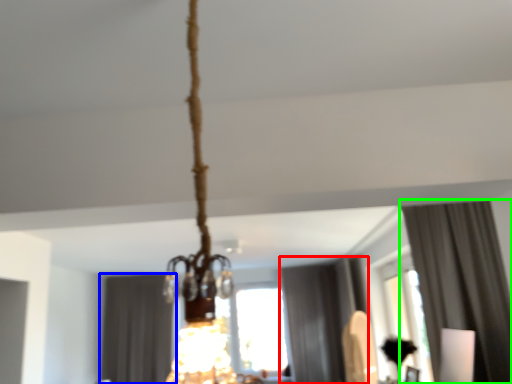
Question: Which object is positioned farthest from curtain (highlighted by a red box)? Select from curtain (highlighted by a blue box) and curtain (highlighted by a green box).

Choices:
 (A) curtain
 (B) curtain

Answer: (B)